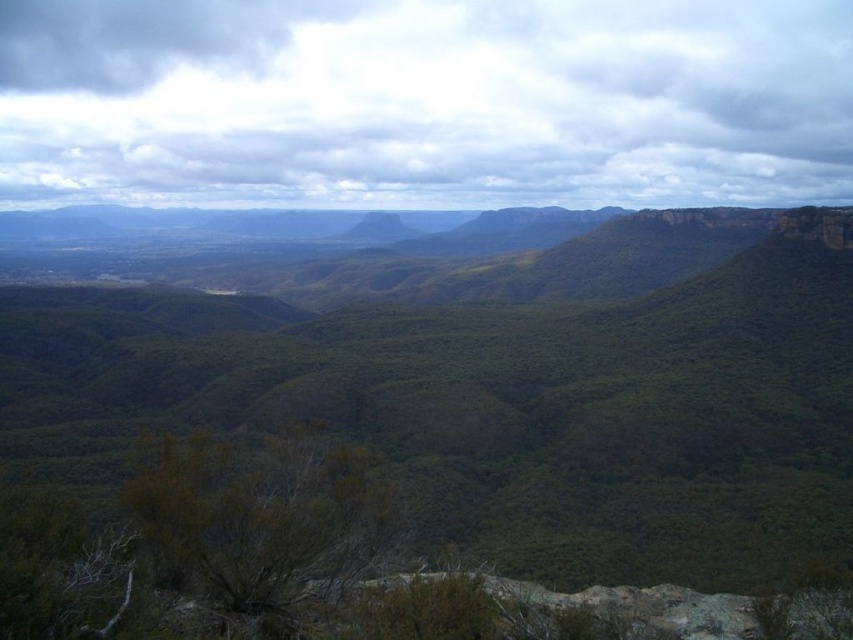
Question: Is cloudy sky at upper center thinner than green grassy peak at center?

Choices:
 (A) yes
 (B) no

Answer: (B)

Question: Among these points, which one is nearest to the camera?

Choices:
 (A) (379, 225)
 (B) (451, 172)

Answer: (A)

Question: Which object appears closest to the camera in this image?

Choices:
 (A) green grassy peak at center
 (B) cloudy sky at upper center

Answer: (A)

Question: Does cloudy sky at upper center have a smaller size compared to green grassy peak at center?

Choices:
 (A) yes
 (B) no

Answer: (B)

Question: Which point is closer to the camera taking this photo?

Choices:
 (A) (381, 237)
 (B) (457, 161)

Answer: (A)

Question: Is cloudy sky at upper center to the left of green grassy peak at center from the viewer's perspective?

Choices:
 (A) yes
 (B) no

Answer: (B)